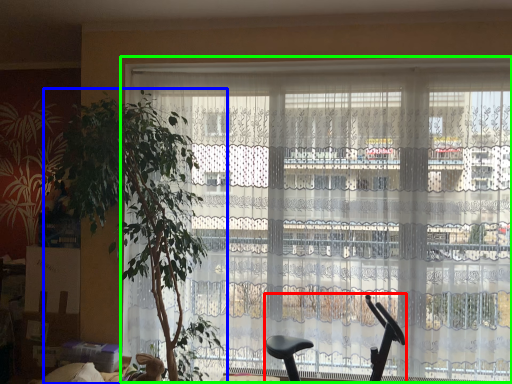
Question: Which object is positioned farthest from baby carriage (highlighted by a red box)? Select from houseplant (highlighted by a blue box) and window (highlighted by a green box).

Choices:
 (A) houseplant
 (B) window

Answer: (A)